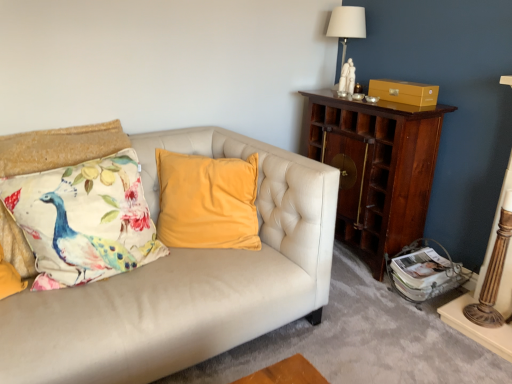
What is the approximate height of wooden cabinet at right?

wooden cabinet at right is 37.78 inches tall.

I want to click on wooden cabinet at right, so click(377, 169).

Between white ceramic table lamp at upper right and wooden cabinet at right, which one appears on the right side from the viewer's perspective?

wooden cabinet at right.

In the scene shown: Is white ceramic table lamp at upper right beside wooden cabinet at right?

No, white ceramic table lamp at upper right is not beside wooden cabinet at right.

What's the angular difference between white ceramic table lamp at upper right and wooden cabinet at right's facing directions?

white ceramic table lamp at upper right and wooden cabinet at right are facing 0.000281 degrees away from each other.

Locate an element on the screen. The image size is (512, 384). table lamp behind the wooden cabinet at right is located at coordinates (347, 24).

Considering the sizes of objects matte gold drawer at upper right and white ceramic table lamp at upper right in the image provided, who is wider, matte gold drawer at upper right or white ceramic table lamp at upper right?

white ceramic table lamp at upper right is wider.

Can you confirm if matte gold drawer at upper right is bigger than white ceramic table lamp at upper right?

No, matte gold drawer at upper right is not bigger than white ceramic table lamp at upper right.

Does matte gold drawer at upper right come behind white ceramic table lamp at upper right?

That is False.

Between matte gold drawer at upper right and white ceramic table lamp at upper right, which one has more height?

With more height is white ceramic table lamp at upper right.

Looking at this image, from a real-world perspective, which is physically above, wooden cabinet at right or matte gold drawer at upper right?

From a 3D spatial view, matte gold drawer at upper right is above.

At what (x,y) coordinates should I click in order to perform the action: click on nightstand on the left side of matte gold drawer at upper right. Please return your answer as a coordinate pair (x, y). The width and height of the screenshot is (512, 384). Looking at the image, I should click on (377, 169).

Is matte gold drawer at upper right a part of wooden cabinet at right?

Actually, matte gold drawer at upper right is outside wooden cabinet at right.

From the picture: Between wooden cabinet at right and matte gold drawer at upper right, which one has more height?

With more height is wooden cabinet at right.

Is white ceramic table lamp at upper right inside printed fabric cushion with peacock design at left?

No, printed fabric cushion with peacock design at left does not contain white ceramic table lamp at upper right.

Is printed fabric cushion with peacock design at left far from white ceramic table lamp at upper right?

printed fabric cushion with peacock design at left is far away from white ceramic table lamp at upper right.

From the image's perspective, does printed fabric cushion with peacock design at left appear lower than white ceramic table lamp at upper right?

Yes, from the image's perspective, printed fabric cushion with peacock design at left is below white ceramic table lamp at upper right.

Is printed fabric cushion with peacock design at left to the right of white ceramic table lamp at upper right from the viewer's perspective?

No.

Consider the image. Is matte gold drawer at upper right inside the boundaries of wooden cabinet at right, or outside?

matte gold drawer at upper right cannot be found inside wooden cabinet at right.

Is matte gold drawer at upper right at the left side of wooden cabinet at right?

No.

Which of these two, matte gold drawer at upper right or wooden cabinet at right, is bigger?

With larger size is wooden cabinet at right.

This screenshot has width=512, height=384. In the image, there is a matte gold drawer at upper right. Find the location of `nightstand below it (from the image's perspective)`. nightstand below it (from the image's perspective) is located at coordinates (377, 169).

In the scene shown: Considering their positions, is wooden cabinet at right located in front of or behind white ceramic table lamp at upper right?

Clearly, wooden cabinet at right is in front of white ceramic table lamp at upper right.

Is wooden cabinet at right oriented towards white ceramic table lamp at upper right?

No, wooden cabinet at right is not facing towards white ceramic table lamp at upper right.

Considering the sizes of objects wooden cabinet at right and white ceramic table lamp at upper right in the image provided, who is wider, wooden cabinet at right or white ceramic table lamp at upper right?

wooden cabinet at right is wider.

Can you tell me how much white ceramic table lamp at upper right and printed fabric cushion with peacock design at left differ in facing direction?

The angle between the facing direction of white ceramic table lamp at upper right and the facing direction of printed fabric cushion with peacock design at left is 89.9 degrees.

At what (x,y) coordinates should I click in order to perform the action: click on pillow below the white ceramic table lamp at upper right (from the image's perspective). Please return your answer as a coordinate pair (x, y). The width and height of the screenshot is (512, 384). Looking at the image, I should click on (84, 220).

Considering the sizes of white ceramic table lamp at upper right and printed fabric cushion with peacock design at left in the image, is white ceramic table lamp at upper right taller or shorter than printed fabric cushion with peacock design at left?

white ceramic table lamp at upper right is taller than printed fabric cushion with peacock design at left.

Is white ceramic table lamp at upper right far away from printed fabric cushion with peacock design at left?

Absolutely, white ceramic table lamp at upper right is distant from printed fabric cushion with peacock design at left.

Locate an element on the screen. nightstand that appears below the white ceramic table lamp at upper right (from a real-world perspective) is located at coordinates (377, 169).

At what (x,y) coordinates should I click in order to perform the action: click on drawer on the right of the white ceramic table lamp at upper right. Please return your answer as a coordinate pair (x, y). Looking at the image, I should click on (404, 92).

Looking at the image, which one is located closer to white ceramic table lamp at upper right, matte gold drawer at upper right or printed fabric cushion with peacock design at left?

matte gold drawer at upper right lies closer to white ceramic table lamp at upper right than the other object.

Estimate the real-world distances between objects in this image. Which object is closer to matte gold drawer at upper right, wooden cabinet at right or printed fabric cushion with peacock design at left?

Among the two, wooden cabinet at right is located nearer to matte gold drawer at upper right.

When comparing their distances from wooden cabinet at right, does printed fabric cushion with peacock design at left or white ceramic table lamp at upper right seem further?

Among the two, printed fabric cushion with peacock design at left is located further to wooden cabinet at right.

Looking at the image, which one is located further to matte gold drawer at upper right, white ceramic table lamp at upper right or wooden cabinet at right?

Among the two, white ceramic table lamp at upper right is located further to matte gold drawer at upper right.

From the image, which object appears to be nearer to printed fabric cushion with peacock design at left, wooden cabinet at right or white ceramic table lamp at upper right?

wooden cabinet at right is positioned closer to the anchor printed fabric cushion with peacock design at left.

In the scene shown: From the image, which object appears to be farther from printed fabric cushion with peacock design at left, white ceramic table lamp at upper right or wooden cabinet at right?

The object further to printed fabric cushion with peacock design at left is white ceramic table lamp at upper right.

When comparing their distances from matte gold drawer at upper right, does white ceramic table lamp at upper right or printed fabric cushion with peacock design at left seem closer?

white ceramic table lamp at upper right lies closer to matte gold drawer at upper right than the other object.

Looking at this image, looking at the image, which one is located further to wooden cabinet at right, matte gold drawer at upper right or printed fabric cushion with peacock design at left?

printed fabric cushion with peacock design at left is positioned further to the anchor wooden cabinet at right.

Where is `nightstand between printed fabric cushion with peacock design at left and matte gold drawer at upper right in the horizontal direction`? Image resolution: width=512 pixels, height=384 pixels. nightstand between printed fabric cushion with peacock design at left and matte gold drawer at upper right in the horizontal direction is located at coordinates (377, 169).

The image size is (512, 384). I want to click on table lamp situated between printed fabric cushion with peacock design at left and matte gold drawer at upper right from left to right, so click(x=347, y=24).

At what (x,y) coordinates should I click in order to perform the action: click on drawer between white ceramic table lamp at upper right and wooden cabinet at right in the up-down direction. Please return your answer as a coordinate pair (x, y). Looking at the image, I should click on (404, 92).

Locate an element on the screen. The width and height of the screenshot is (512, 384). table lamp between printed fabric cushion with peacock design at left and wooden cabinet at right in the horizontal direction is located at coordinates (347, 24).